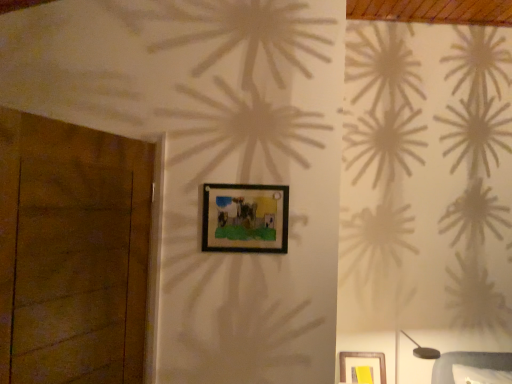
Question: In the image, is metallic gray table lamp at lower right positioned in front of or behind black matte picture frame at center?

Choices:
 (A) behind
 (B) front

Answer: (A)

Question: Is point (432, 349) positioned closer to the camera than point (220, 203)?

Choices:
 (A) farther
 (B) closer

Answer: (A)

Question: Which of these objects is positioned farthest from the brown wooden door at left?

Choices:
 (A) metallic gray table lamp at lower right
 (B) black matte picture frame at center

Answer: (A)

Question: Which is nearer to the black matte picture frame at center?

Choices:
 (A) brown wooden door at left
 (B) metallic gray table lamp at lower right

Answer: (A)